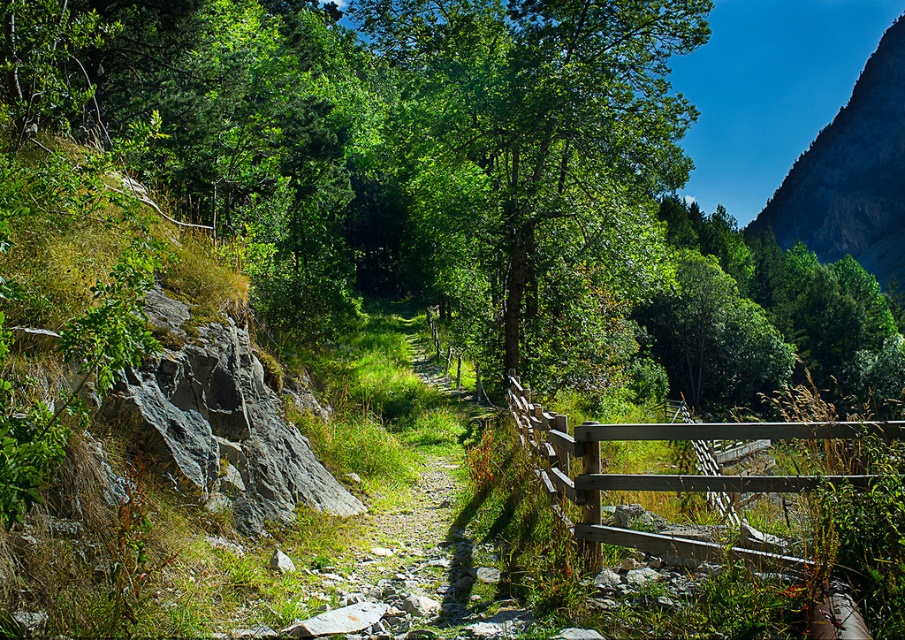
Based on the photo, who is more distant from viewer, (886,368) or (720,484)?

Positioned behind is point (886,368).

Based on the photo, does green leafy tree at upper center appear over wooden gate at center?

Indeed, green leafy tree at upper center is positioned over wooden gate at center.

Which is behind, point (702, 214) or point (578, 449)?

Point (702, 214)

This screenshot has height=640, width=905. I want to click on green leafy tree at upper center, so click(x=769, y=317).

Which is more to the left, green leafy tree at center or wooden gate at center?

green leafy tree at center

Is point (645, 120) closer to camera compared to point (741, 435)?

No, (645, 120) is behind (741, 435).

Image resolution: width=905 pixels, height=640 pixels. Describe the element at coordinates (539, 164) in the screenshot. I see `green leafy tree at center` at that location.

What are the coordinates of `green leafy tree at center` in the screenshot? It's located at (539, 164).

From the picture: Is green leafy tree at center closer to the viewer compared to rocky cliff at upper right?

That is True.

Between point (500, 186) and point (888, 186), which one is positioned in front?

Positioned in front is point (500, 186).

At what (x,y) coordinates should I click in order to perform the action: click on green leafy tree at center. Please return your answer as a coordinate pair (x, y). Looking at the image, I should click on (539, 164).